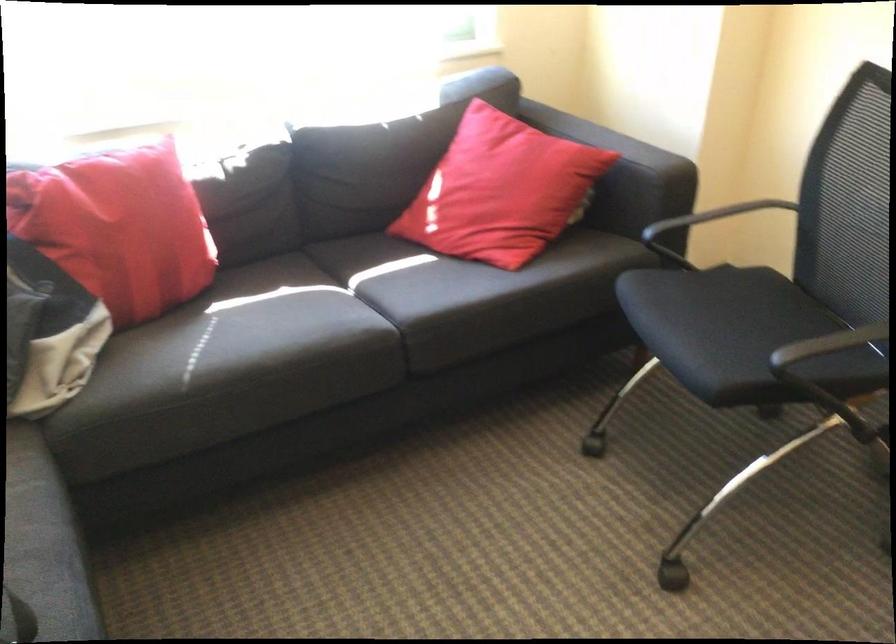
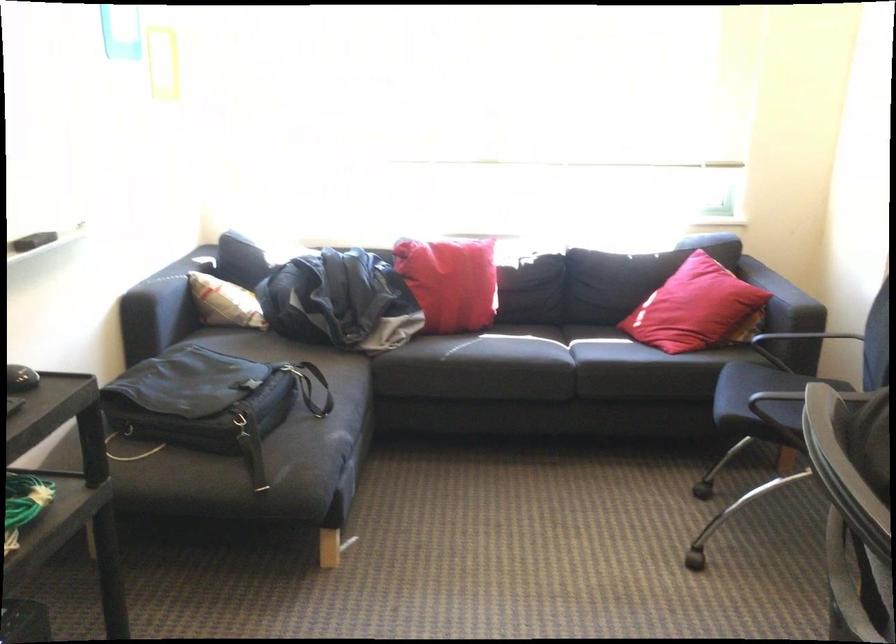
The point at [138,243] is marked in the first image. Where is the corresponding point in the second image?

(450, 281)